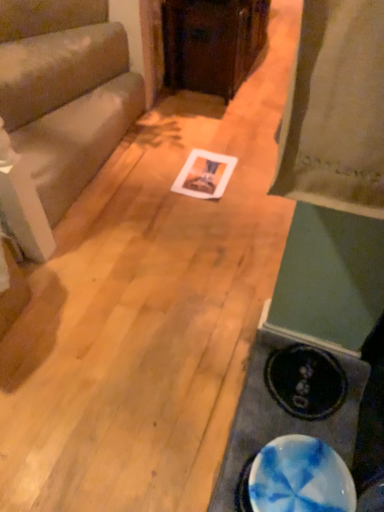
Question: Is matte gray couch at left, acting as the first furniture starting from the left, placed right next to blue marble table at lower right?

Choices:
 (A) no
 (B) yes

Answer: (A)

Question: Can you confirm if matte gray couch at left, placed as the 2th furniture when sorted from top to bottom, is bigger than blue marble table at lower right?

Choices:
 (A) yes
 (B) no

Answer: (A)

Question: Is matte gray couch at left, acting as the first furniture starting from the left, smaller than blue marble table at lower right?

Choices:
 (A) no
 (B) yes

Answer: (A)

Question: Is matte gray couch at left, which ranks as the second furniture in right-to-left order, to the right of blue marble table at lower right from the viewer's perspective?

Choices:
 (A) no
 (B) yes

Answer: (A)

Question: Is matte gray couch at left, which ranks as the 1th furniture in bottom-to-top order, positioned before blue marble table at lower right?

Choices:
 (A) yes
 (B) no

Answer: (B)

Question: Do you think blue marble table at lower right is within wooden cabinet at center, the first furniture positioned from the top, or outside of it?

Choices:
 (A) outside
 (B) inside

Answer: (A)

Question: From the image's perspective, relative to wooden cabinet at center, which is the 1th furniture in right-to-left order, is blue marble table at lower right above or below?

Choices:
 (A) above
 (B) below

Answer: (B)

Question: Looking at their shapes, would you say blue marble table at lower right is wider or thinner than wooden cabinet at center, the first furniture positioned from the top?

Choices:
 (A) wide
 (B) thin

Answer: (B)

Question: From a real-world perspective, relative to wooden cabinet at center, positioned as the 2th furniture in bottom-to-top order, is blue marble table at lower right vertically above or below?

Choices:
 (A) below
 (B) above

Answer: (A)

Question: From a real-world perspective, is blue marbled plate at lower right above or below blue marble table at lower right?

Choices:
 (A) above
 (B) below

Answer: (A)

Question: Considering the positions of point (299, 473) and point (238, 404), is point (299, 473) closer or farther from the camera than point (238, 404)?

Choices:
 (A) farther
 (B) closer

Answer: (B)

Question: Considering the positions of blue marbled plate at lower right and blue marble table at lower right in the image, is blue marbled plate at lower right wider or thinner than blue marble table at lower right?

Choices:
 (A) thin
 (B) wide

Answer: (A)

Question: Looking at the image, does blue marbled plate at lower right seem bigger or smaller compared to blue marble table at lower right?

Choices:
 (A) big
 (B) small

Answer: (B)

Question: Is blue marble table at lower right wider or thinner than blue marbled plate at lower right?

Choices:
 (A) thin
 (B) wide

Answer: (B)

Question: Relative to blue marbled plate at lower right, is blue marble table at lower right in front or behind?

Choices:
 (A) behind
 (B) front

Answer: (A)